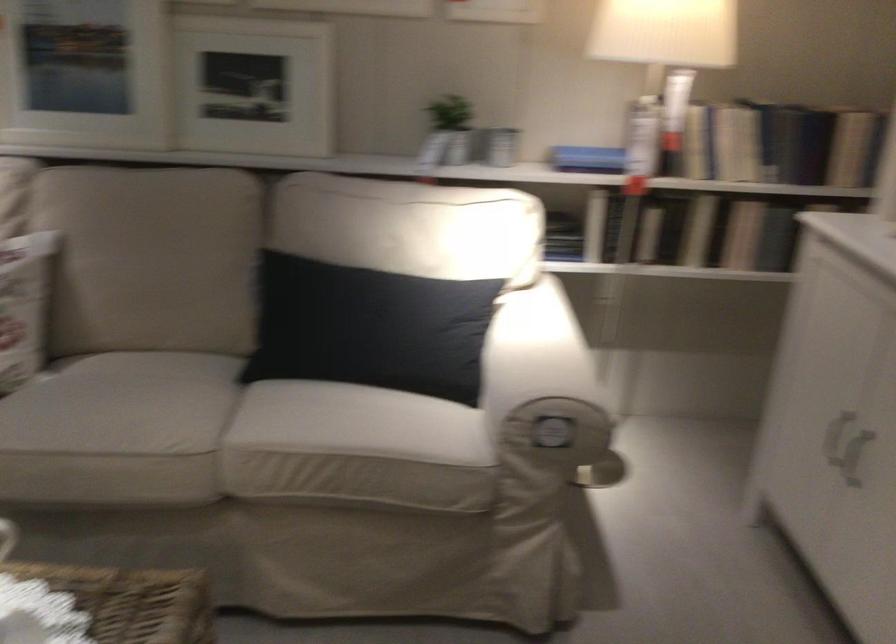
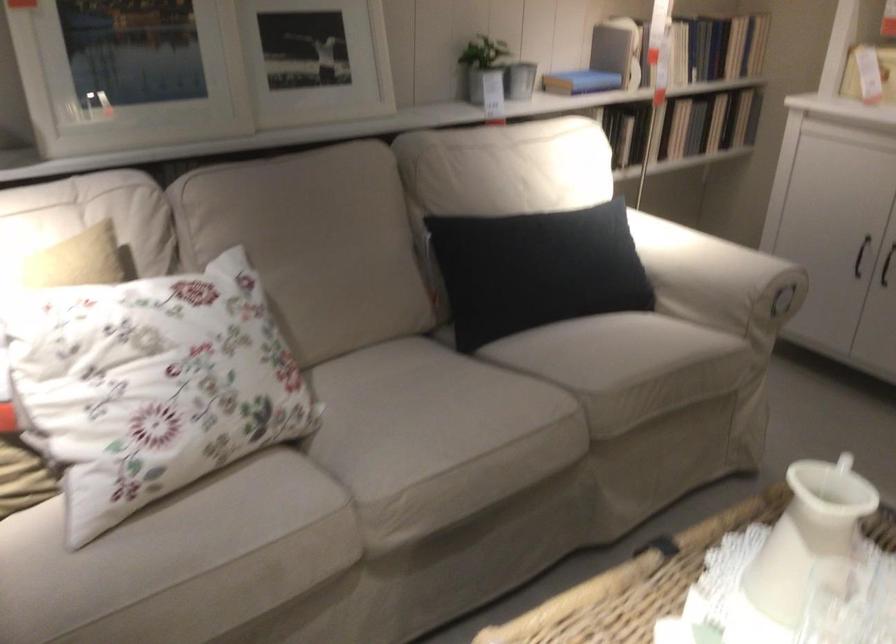
Find the pixel in the second image that matches point 503,389 in the first image.

(717, 279)